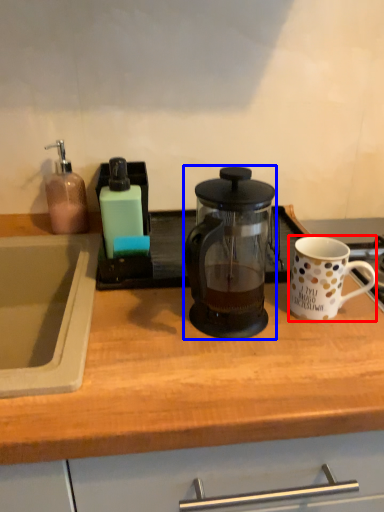
Question: Which object is closer to the camera taking this photo, coffee cup (highlighted by a red box) or kettle (highlighted by a blue box)?

Choices:
 (A) coffee cup
 (B) kettle

Answer: (B)